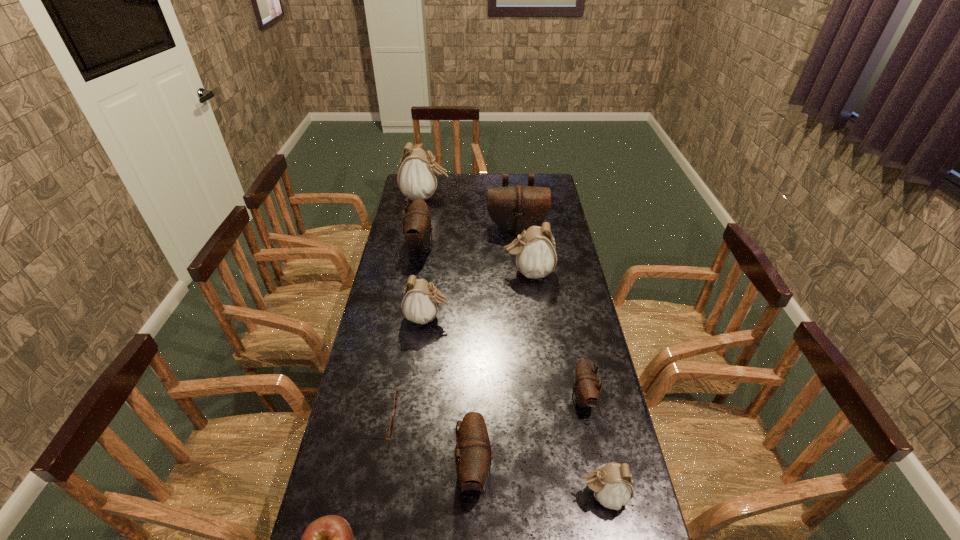
At what (x,y) coordinates should I click in order to perform the action: click on vacant space positioned on the front-facing side of the smallest white pouch. Please return your answer as a coordinate pair (x, y). Looking at the image, I should click on (443, 495).

Where is `vacant position located on the front-facing side of the smallest white pouch`? This screenshot has width=960, height=540. vacant position located on the front-facing side of the smallest white pouch is located at coordinates [494, 495].

You are a GUI agent. You are given a task and a screenshot of the screen. Output one action in this format:
    pyautogui.click(x=<x>, y=<y>)
    Task: Click on the blank space located 0.310m on the front-facing side of the smallest white pouch
    This screenshot has height=540, width=960.
    Given the screenshot: What is the action you would take?
    [454, 495]

The height and width of the screenshot is (540, 960). In order to click on vacant space located 0.330m with the flap open on the third farthest brown pouch in this screenshot , I will do `click(460, 397)`.

This screenshot has height=540, width=960. Find the location of `vacant space located with the flap open on the third farthest brown pouch`. vacant space located with the flap open on the third farthest brown pouch is located at coordinates click(x=520, y=397).

Find the location of `vacant space located 0.180m with the flap open on the third farthest brown pouch`. vacant space located 0.180m with the flap open on the third farthest brown pouch is located at coordinates (510, 397).

Where is `vacant space located 0.140m on the face of the sunglasses`? vacant space located 0.140m on the face of the sunglasses is located at coordinates (444, 417).

Where is `object situated at the far edge`? Image resolution: width=960 pixels, height=540 pixels. object situated at the far edge is located at coordinates (417, 177).

Locate an element on the screen. The height and width of the screenshot is (540, 960). sunglasses present at the left edge is located at coordinates (396, 393).

You are a GUI agent. You are given a task and a screenshot of the screen. Output one action in this format:
    pyautogui.click(x=<x>, y=<y>)
    Task: Click on the object that is positioned at the far left corner
    This screenshot has height=540, width=960.
    Given the screenshot: What is the action you would take?
    pyautogui.click(x=417, y=177)